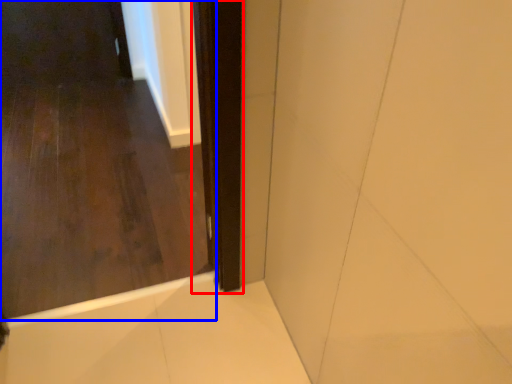
Question: Which point is further to the camera, screen door (highlighted by a red box) or door (highlighted by a blue box)?

Choices:
 (A) screen door
 (B) door

Answer: (A)